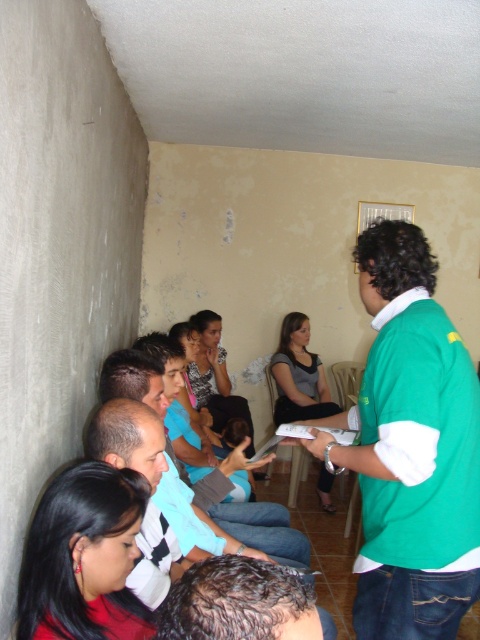
You are a photographer positioned in front of the group. You need to take a photo that includes both the black hair at lower left and the dark brown hair at center. Which person should be closer to the camera to ensure both are in focus?

The black hair at lower left is closer to the camera than the dark brown hair at center. To ensure both are in focus, position the camera so that the black hair at lower left is closer to the lens while maintaining a distance that allows the dark brown hair at center to remain within the depth of field.

You are organizing a clothing donation drive and need to categorize shirts by size. You have two shirts in front of you, the green fabric shirt at center and the light blue shirt at center. Based on their sizes, which one should you place in the small size bin?

The green fabric shirt at center has a smaller width than the light blue shirt at center, so it should be placed in the small size bin.